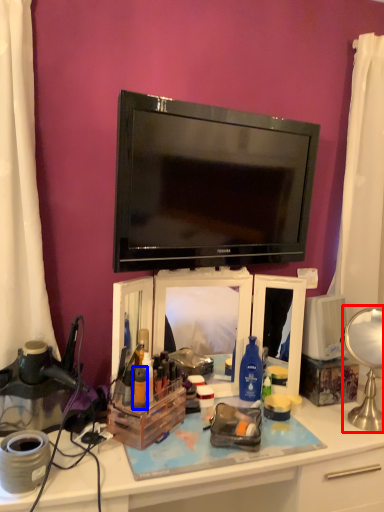
Question: Which object is further to the camera taking this photo, table lamp (highlighted by a red box) or toiletry (highlighted by a blue box)?

Choices:
 (A) table lamp
 (B) toiletry

Answer: (A)